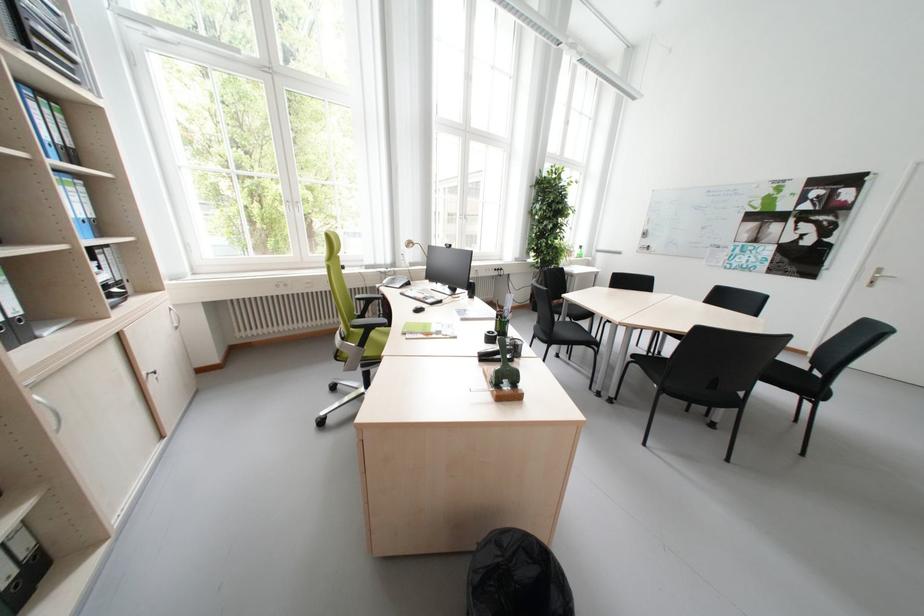
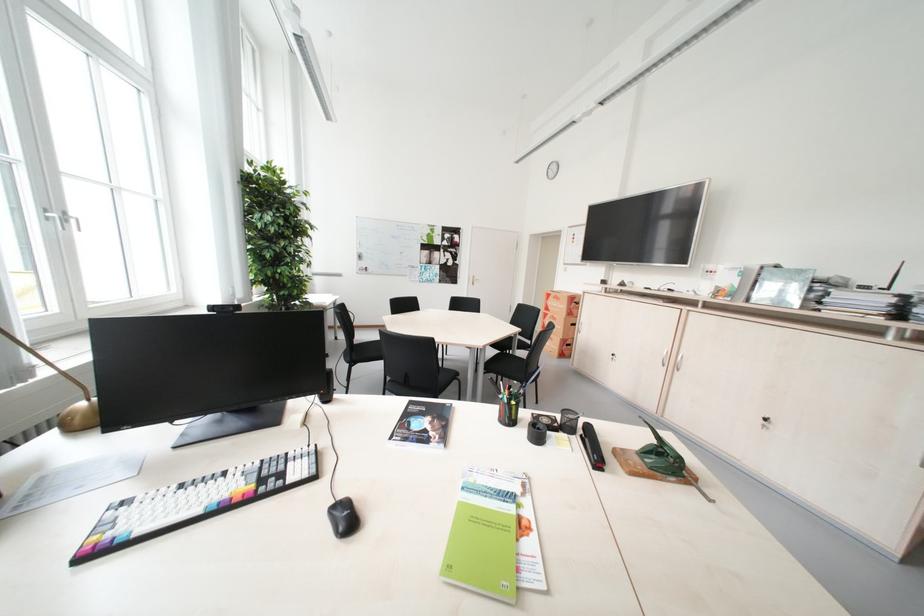
Locate, in the second image, the point that corresponds to [429,312] in the first image.

(359, 521)